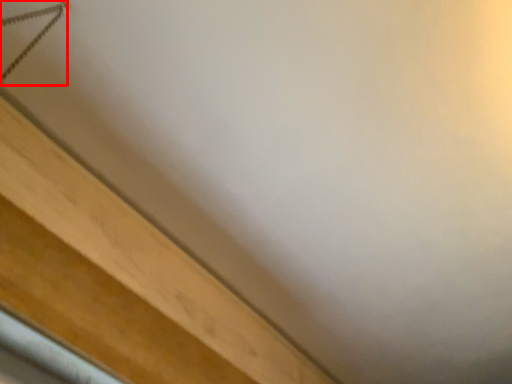
Question: From the image's perspective, what is the correct spatial positioning of twin (annotated by the red box) in reference to furniture?

Choices:
 (A) below
 (B) above

Answer: (B)